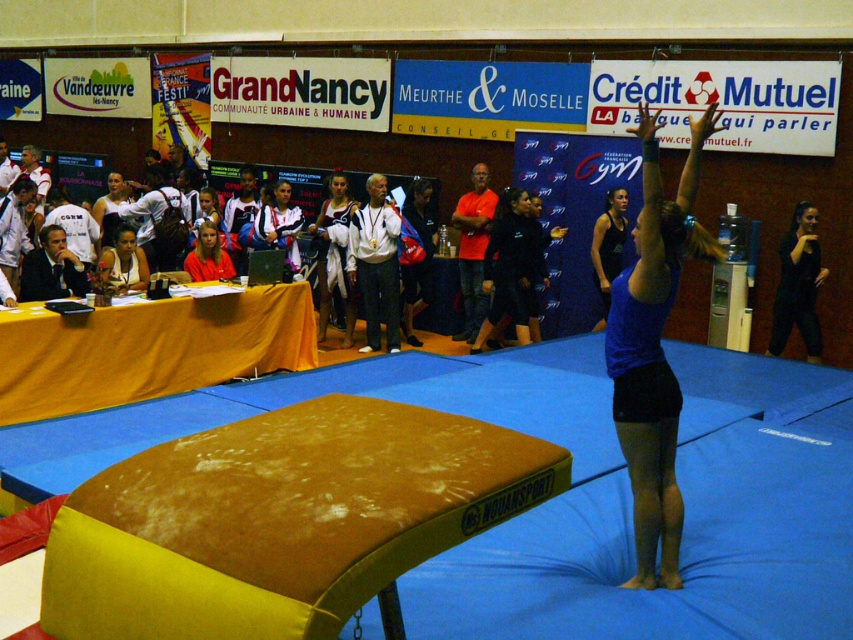
Question: Which object is positioned closest to the white cotton shirt at center?

Choices:
 (A) matte black jacket at center
 (B) blue matte tank top at center
 (C) red fabric shirt at center

Answer: (A)

Question: Among these objects, which one is nearest to the camera?

Choices:
 (A) red fabric shirt at center
 (B) white cotton shirt at center

Answer: (A)

Question: Does white cotton shirt at center have a lesser width compared to red fabric shirt at center?

Choices:
 (A) no
 (B) yes

Answer: (A)

Question: Does blue matte tank top at center appear on the right side of white cotton shirt at center?

Choices:
 (A) yes
 (B) no

Answer: (A)

Question: Which is nearer to the white cotton shirt at center?

Choices:
 (A) blue matte tank top at center
 (B) matte black jacket at center
 (C) red fabric shirt at center

Answer: (B)

Question: Is blue matte tank top at center below white cotton shirt at center?

Choices:
 (A) yes
 (B) no

Answer: (A)